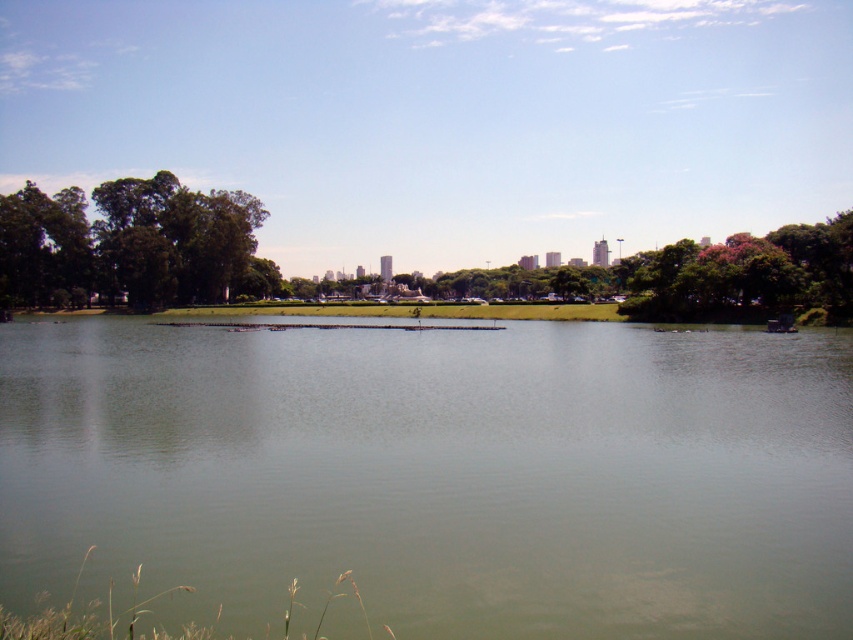
Question: Can you confirm if green leafy tree at left is positioned below pink textured tree at right?

Choices:
 (A) yes
 (B) no

Answer: (B)

Question: Can you confirm if green smooth water at center is bigger than green leafy tree at left?

Choices:
 (A) yes
 (B) no

Answer: (B)

Question: Among these objects, which one is farthest from the camera?

Choices:
 (A) pink textured tree at right
 (B) green smooth water at center
 (C) green leafy tree at left

Answer: (C)

Question: Among these objects, which one is farthest from the camera?

Choices:
 (A) pink textured tree at right
 (B) green leafy tree at left

Answer: (B)

Question: Is the position of green smooth water at center less distant than that of green leafy tree at left?

Choices:
 (A) no
 (B) yes

Answer: (B)

Question: Which point is farther from the camera taking this photo?

Choices:
 (A) (131, 515)
 (B) (196, 253)
 (C) (810, 262)

Answer: (B)